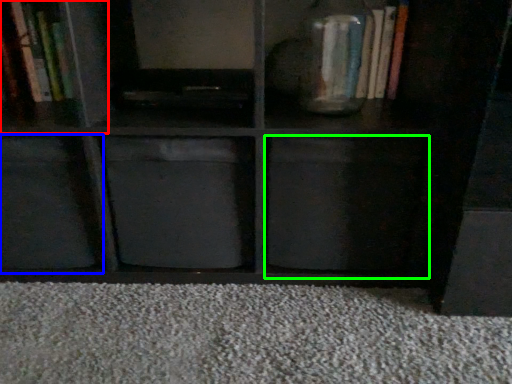
Question: Which object is the closest to the cabinet (highlighted by a red box)? Choose among these: cabinet (highlighted by a blue box) or drawer (highlighted by a green box).

Choices:
 (A) cabinet
 (B) drawer

Answer: (A)